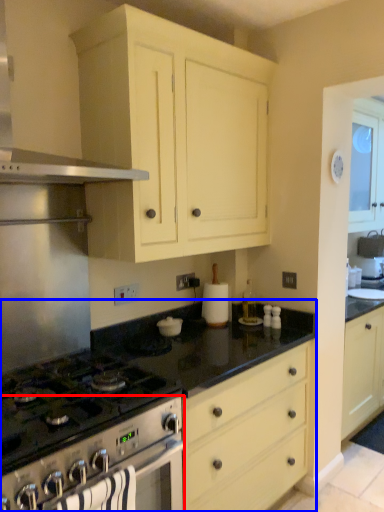
Question: Which object appears farthest to the camera in this image, oven (highlighted by a red box) or countertop (highlighted by a blue box)?

Choices:
 (A) oven
 (B) countertop

Answer: (B)